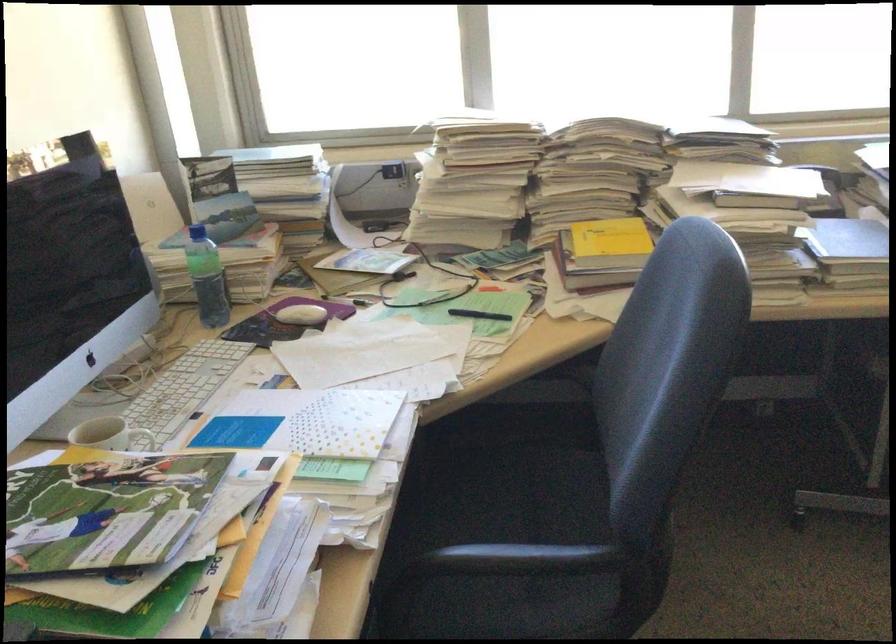
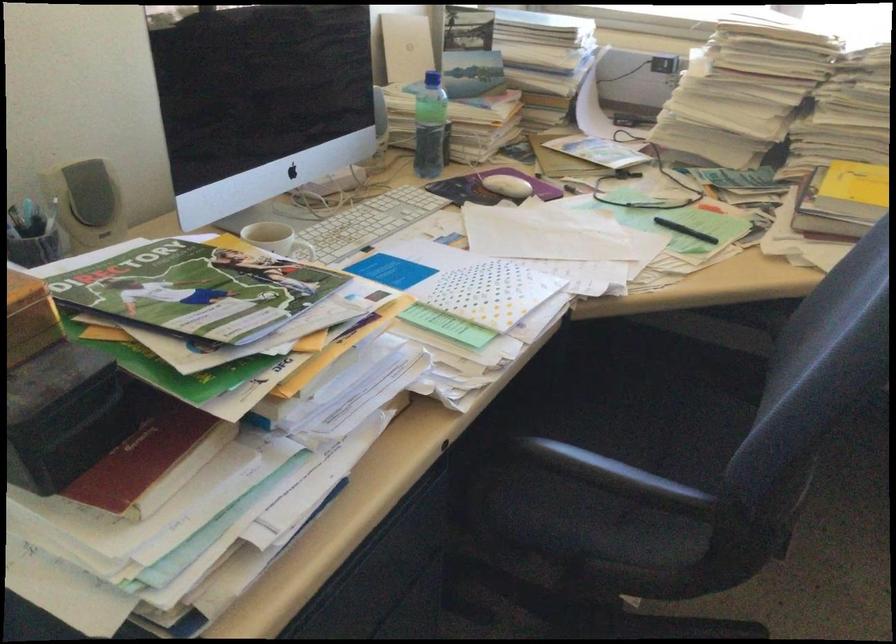
The point at [70,527] is marked in the first image. Where is the corresponding point in the second image?

(195, 290)